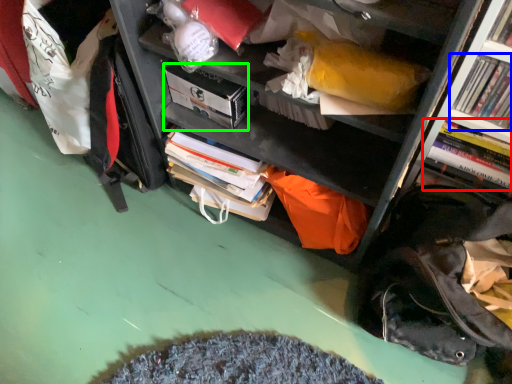
Question: Estimate the real-world distances between objects in this image. Which object is farther from book (highlighted by a red box), book (highlighted by a blue box) or paperback book (highlighted by a green box)?

Choices:
 (A) book
 (B) paperback book

Answer: (B)